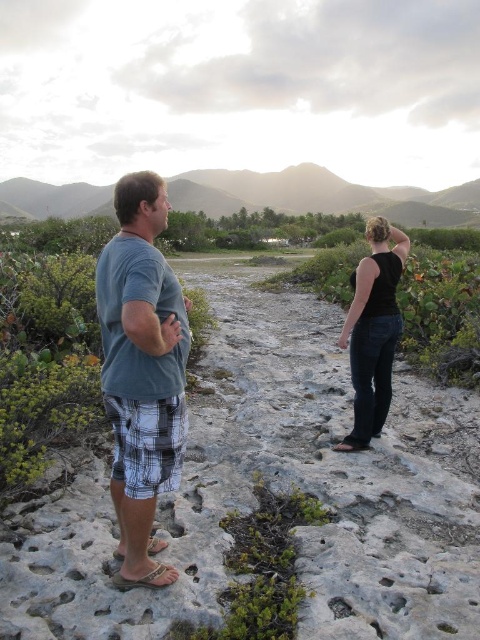
Question: Among these objects, which one is farthest from the camera?

Choices:
 (A) gray stone path at center
 (B) gray cotton shirt at left
 (C) black denim jeans at center

Answer: (C)

Question: Does gray stone path at center appear under gray cotton shirt at left?

Choices:
 (A) yes
 (B) no

Answer: (A)

Question: Which of the following is the farthest from the observer?

Choices:
 (A) gray stone path at center
 (B) black denim jeans at center

Answer: (B)

Question: Based on their relative distances, which object is nearer to the gray cotton shirt at left?

Choices:
 (A) black denim jeans at center
 (B) gray stone path at center

Answer: (B)

Question: Does gray stone path at center appear on the left side of black denim jeans at center?

Choices:
 (A) yes
 (B) no

Answer: (A)

Question: Where is gray cotton shirt at left located in relation to black denim jeans at center in the image?

Choices:
 (A) above
 (B) below

Answer: (B)